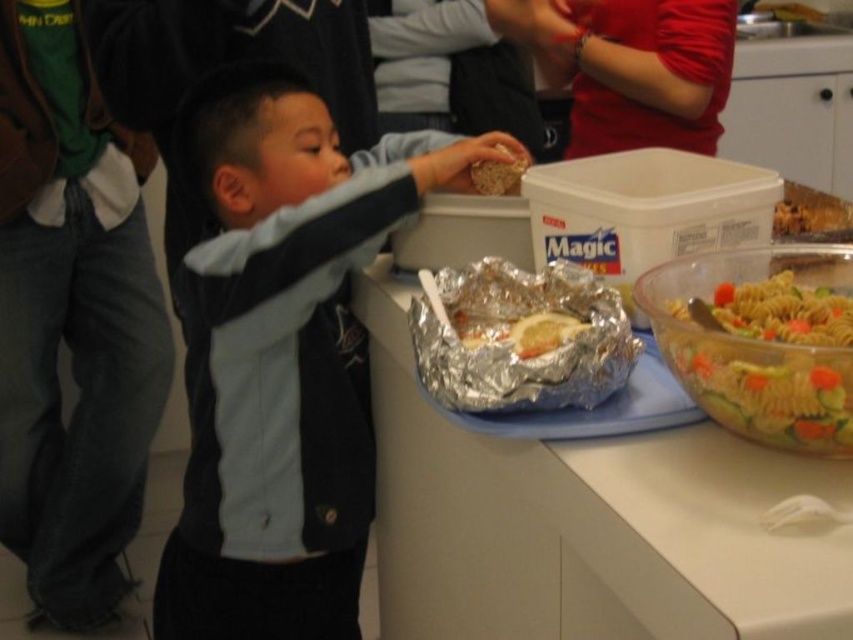
Which is below, green brushed fabric pants at lower left or matte brown rice at upper center?

green brushed fabric pants at lower left

Which is more to the left, green brushed fabric pants at lower left or matte brown rice at upper center?

Positioned to the left is green brushed fabric pants at lower left.

Is point (108, 545) more distant than point (492, 193)?

Yes, point (108, 545) is farther from viewer.

What are the coordinates of `green brushed fabric pants at lower left` in the screenshot? It's located at (73, 317).

Does point (35, 355) come in front of point (770, 436)?

No, (35, 355) is further to viewer.

Is point (142, 346) in front of point (798, 360)?

No, (142, 346) is behind (798, 360).

Image resolution: width=853 pixels, height=640 pixels. In order to click on green brushed fabric pants at lower left in this screenshot , I will do `click(73, 317)`.

Does silver foil tray at center appear over multicolored pasta salad at right?

Answer: Actually, silver foil tray at center is below multicolored pasta salad at right.

Does silver foil tray at center have a larger size compared to multicolored pasta salad at right?

Correct, silver foil tray at center is larger in size than multicolored pasta salad at right.

Identify the location of silver foil tray at center. (590, 524).